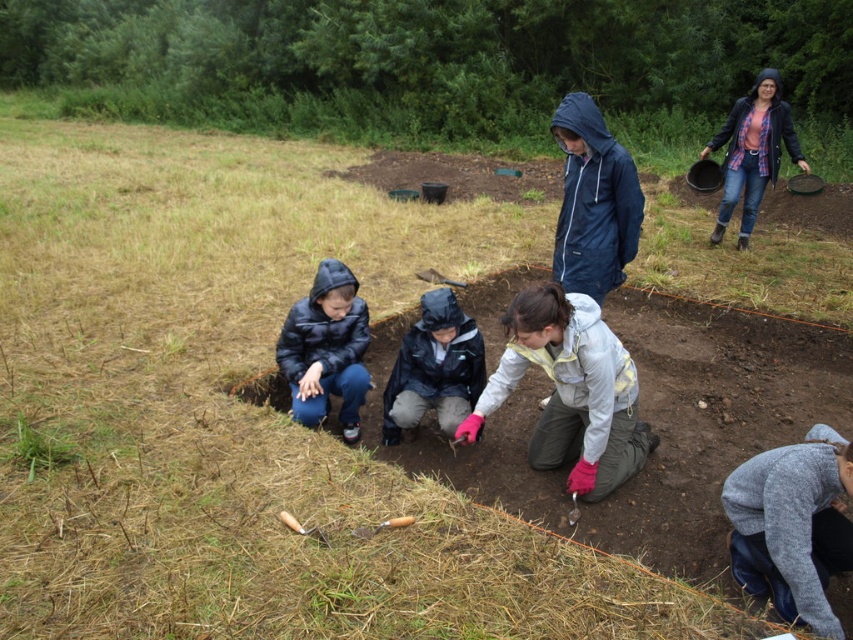
From the picture: You are an archaeologist at the dig site and need to borrow a jacket from the team members. The blue waterproof jacket at upper center and the black matte jacket at center are both available. Which jacket is bigger in size?

The blue waterproof jacket at upper center is larger in size than the black matte jacket at center.